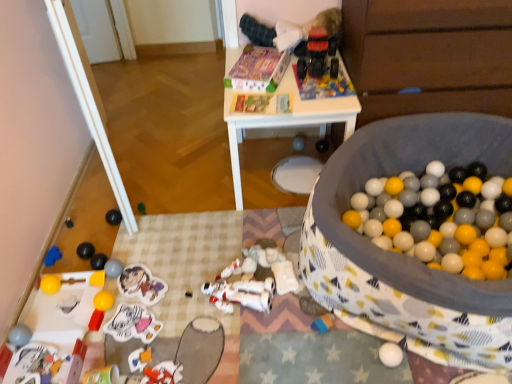
The height and width of the screenshot is (384, 512). I want to click on vacant area that lies between matte white sticker at center, the fourteenth toy when ordered from left to right, and white fabric doll at center, positioned as the seventeenth toy in left-to-right order, so click(x=197, y=309).